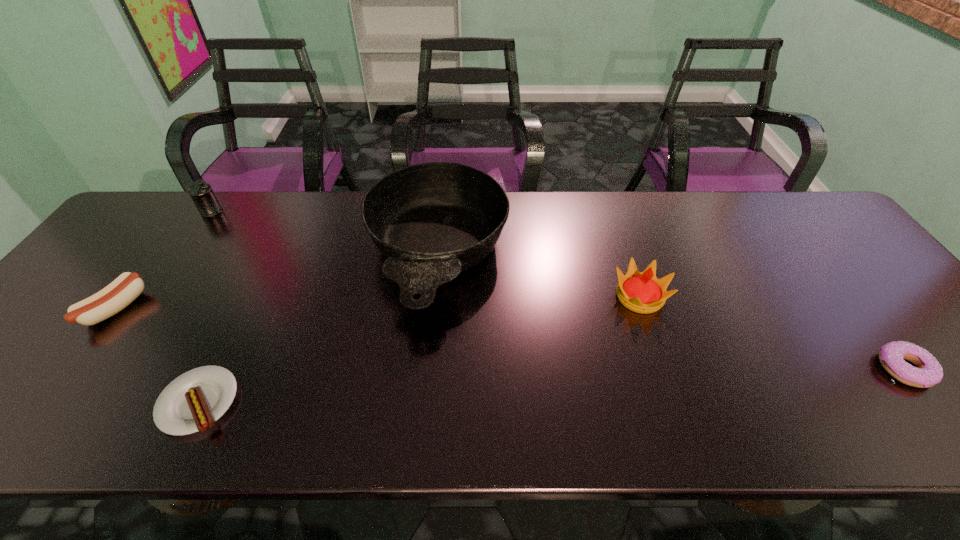
You are a GUI agent. You are given a task and a screenshot of the screen. Output one action in this format:
    pyautogui.click(x=<x>, y=<y>)
    Task: Click on the vacant area at the far edge
    The height and width of the screenshot is (540, 960).
    Given the screenshot: What is the action you would take?
    pyautogui.click(x=628, y=208)

Find the location of `free space at the near edge`. free space at the near edge is located at coordinates 884,422.

The height and width of the screenshot is (540, 960). Identify the location of vacant space at the left edge of the desktop. (91, 270).

The width and height of the screenshot is (960, 540). Identify the location of vacant space at the right edge. (848, 269).

Locate an element on the screen. This screenshot has width=960, height=540. vacant space at the far left corner of the desktop is located at coordinates (171, 221).

Identify the location of free space at the far right corner of the desktop. This screenshot has height=540, width=960. (839, 237).

This screenshot has width=960, height=540. Find the location of `unoccupied area between the shorter sausage and the fourth object from left to right`. unoccupied area between the shorter sausage and the fourth object from left to right is located at coordinates (318, 329).

Where is `vacant area that lies between the can and the shorter sausage`? vacant area that lies between the can and the shorter sausage is located at coordinates (205, 307).

This screenshot has width=960, height=540. I want to click on vacant point located between the doughnut and the left sausage, so click(x=510, y=339).

At what (x,y) coordinates should I click in order to perform the action: click on vacant space that is in between the can and the fourth object from left to right. Please return your answer as a coordinate pair (x, y). The image size is (960, 540). Looking at the image, I should click on (324, 234).